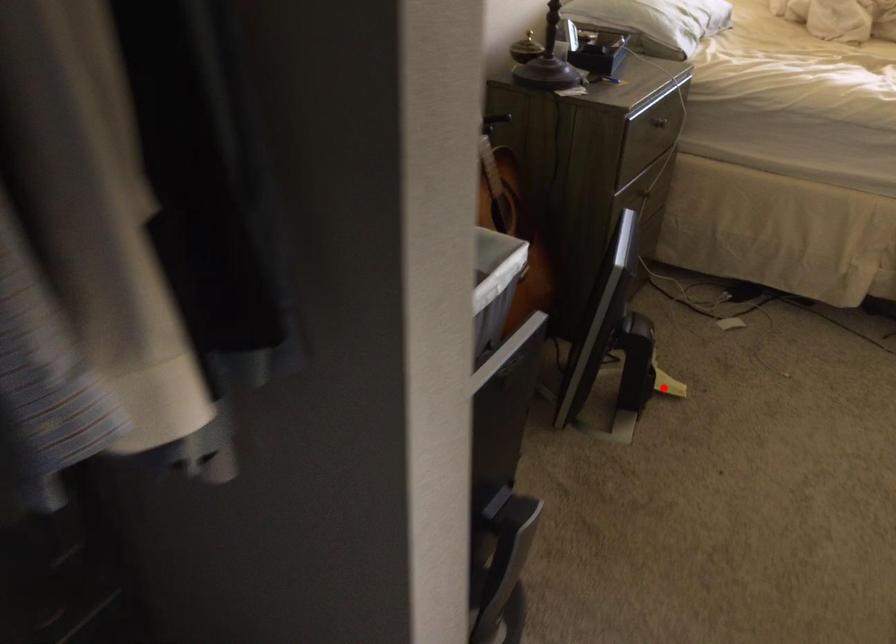
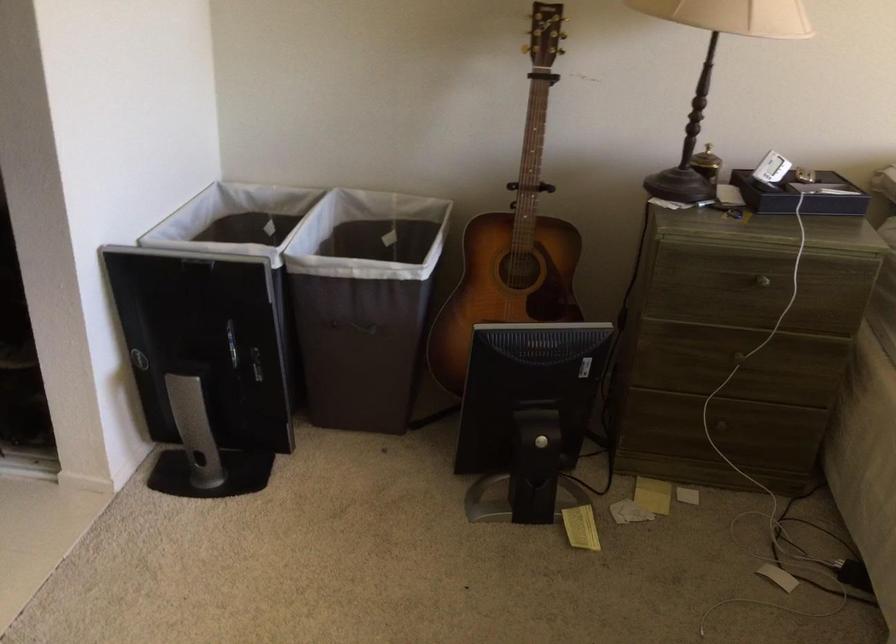
Where in the second image is the point corresponding to the highlighted location from the first image?

(581, 527)